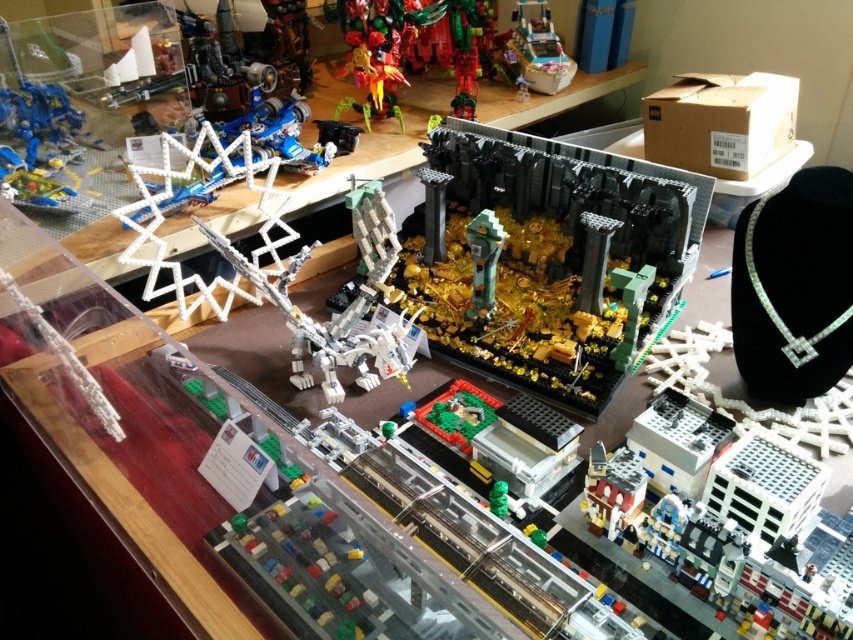
Question: Is dark gray stone structure at center positioned in front of metallic silver car at upper right?

Choices:
 (A) no
 (B) yes

Answer: (B)

Question: Is dark gray stone structure at center wider than metallic silver car at upper right?

Choices:
 (A) yes
 (B) no

Answer: (A)

Question: Can you confirm if dark gray stone structure at center is smaller than metallic silver car at upper right?

Choices:
 (A) no
 (B) yes

Answer: (A)

Question: Among these objects, which one is nearest to the camera?

Choices:
 (A) dark gray stone structure at center
 (B) metallic silver car at upper right

Answer: (A)

Question: Which object is farther from the camera taking this photo?

Choices:
 (A) metallic silver car at upper right
 (B) dark gray stone structure at center

Answer: (A)